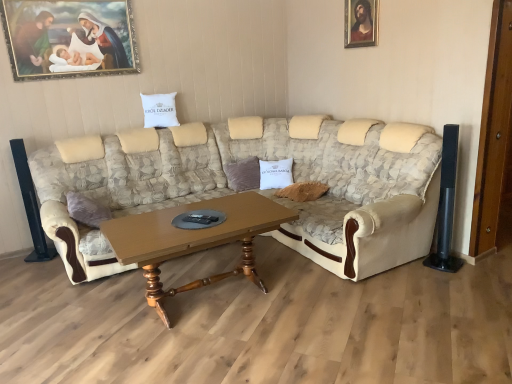
What do you see at coordinates (260, 191) in the screenshot? I see `beige fabric couch at center` at bounding box center [260, 191].

Locate an element on the screen. brown wooden coffee table at center is located at coordinates (193, 239).

From the image's perspective, is brown wooden coffee table at center below gold-framed painting at upper left, marked as the 1th picture frame in a left-to-right arrangement?

Yes, from the image's perspective, brown wooden coffee table at center is below gold-framed painting at upper left, marked as the 1th picture frame in a left-to-right arrangement.

How different are the orientations of brown wooden coffee table at center and gold-framed painting at upper left, marked as the 1th picture frame in a left-to-right arrangement, in degrees?

1.62 degrees.

Are brown wooden coffee table at center and gold-framed painting at upper left, marked as the 1th picture frame in a left-to-right arrangement, making contact?

No.

Which is in front, point (123, 256) or point (61, 34)?

The point (123, 256) is closer to the camera.

The image size is (512, 384). What are the coordinates of `studio couch lying below the wooden framed portrait at upper right, arranged as the first picture frame when viewed from the right (from the image's perspective)` in the screenshot? It's located at (260, 191).

Are wooden framed portrait at upper right, which is counted as the second picture frame, starting from the left, and beige fabric couch at center beside each other?

No, wooden framed portrait at upper right, which is counted as the second picture frame, starting from the left, is not making contact with beige fabric couch at center.

Looking at this image, is wooden framed portrait at upper right, arranged as the first picture frame when viewed from the right, completely or partially outside of beige fabric couch at center?

wooden framed portrait at upper right, arranged as the first picture frame when viewed from the right, is positioned outside beige fabric couch at center.

Locate an element on the screen. The height and width of the screenshot is (384, 512). pillow below the white cotton pillow at center, marked as the second pillow in a right-to-left arrangement (from a real-world perspective) is located at coordinates (275, 174).

Can you confirm if white cotton pillow at center, the first pillow from the top, is smaller than white cotton pillow at center, which appears as the first pillow when ordered from the bottom?

Indeed, white cotton pillow at center, the first pillow from the top, has a smaller size compared to white cotton pillow at center, which appears as the first pillow when ordered from the bottom.

Considering the relative positions of white cotton pillow at center, which ranks as the 1th pillow in left-to-right order, and white cotton pillow at center, which is counted as the 1th pillow, starting from the right, in the image provided, is white cotton pillow at center, which ranks as the 1th pillow in left-to-right order, to the left or to the right of white cotton pillow at center, which is counted as the 1th pillow, starting from the right,?

white cotton pillow at center, which ranks as the 1th pillow in left-to-right order, is positioned on white cotton pillow at center, which is counted as the 1th pillow, starting from the right,'s left side.

Find the location of `coffee table that is in front of the white cotton pillow at center, which appears as the first pillow when ordered from the bottom`. coffee table that is in front of the white cotton pillow at center, which appears as the first pillow when ordered from the bottom is located at coordinates click(x=193, y=239).

From the image's perspective, is brown wooden coffee table at center positioned above or below white cotton pillow at center, positioned as the 2th pillow in top-to-bottom order?

From the image's perspective, brown wooden coffee table at center appears below white cotton pillow at center, positioned as the 2th pillow in top-to-bottom order.

Which is closer, (113, 246) or (269, 176)?

Point (113, 246) is positioned closer to the camera compared to point (269, 176).

Is beige fabric couch at center next to gold-framed painting at upper left, marked as the 1th picture frame in a left-to-right arrangement, and touching it?

No, beige fabric couch at center is not in contact with gold-framed painting at upper left, marked as the 1th picture frame in a left-to-right arrangement.

From a real-world perspective, is beige fabric couch at center positioned under gold-framed painting at upper left, marked as the 1th picture frame in a left-to-right arrangement, based on gravity?

Yes, from a real-world perspective, beige fabric couch at center is below gold-framed painting at upper left, marked as the 1th picture frame in a left-to-right arrangement.

From the image's perspective, relative to gold-framed painting at upper left, acting as the second picture frame starting from the right, is beige fabric couch at center above or below?

Based on their image positions, beige fabric couch at center is located beneath gold-framed painting at upper left, acting as the second picture frame starting from the right.

How different are the orientations of beige fabric couch at center and gold-framed painting at upper left, acting as the second picture frame starting from the right, in degrees?

0.0462 degrees.

Between wooden framed portrait at upper right, arranged as the first picture frame when viewed from the right, and white cotton pillow at center, which is the 2th pillow from left to right, which one has smaller width?

wooden framed portrait at upper right, arranged as the first picture frame when viewed from the right, is thinner.

From the white cotton pillow at center, which appears as the first pillow when ordered from the bottom, count 1st picture frames forward and point to it. Please provide its 2D coordinates.

[(360, 23)]

Looking at this image, which object is positioned more to the right, wooden framed portrait at upper right, which is counted as the second picture frame, starting from the left, or white cotton pillow at center, positioned as the 2th pillow in top-to-bottom order?

Positioned to the right is wooden framed portrait at upper right, which is counted as the second picture frame, starting from the left.

Which of these two, wooden framed portrait at upper right, which is counted as the second picture frame, starting from the left, or white cotton pillow at center, which is counted as the 1th pillow, starting from the right, is smaller?

Smaller between the two is wooden framed portrait at upper right, which is counted as the second picture frame, starting from the left.

How different are the orientations of white cotton pillow at center, which is the 2th pillow from left to right, and gold-framed painting at upper left, acting as the second picture frame starting from the right, in degrees?

They differ by 36.5 degrees in their facing directions.

Considering the sizes of objects white cotton pillow at center, which is counted as the 1th pillow, starting from the right, and gold-framed painting at upper left, marked as the 1th picture frame in a left-to-right arrangement, in the image provided, who is thinner, white cotton pillow at center, which is counted as the 1th pillow, starting from the right, or gold-framed painting at upper left, marked as the 1th picture frame in a left-to-right arrangement,?

gold-framed painting at upper left, marked as the 1th picture frame in a left-to-right arrangement.

Is white cotton pillow at center, which is the 2th pillow from left to right, to the left or to the right of gold-framed painting at upper left, marked as the 1th picture frame in a left-to-right arrangement, in the image?

white cotton pillow at center, which is the 2th pillow from left to right, is to the right of gold-framed painting at upper left, marked as the 1th picture frame in a left-to-right arrangement.

Identify the location of picture frame that is the 1st object above the white cotton pillow at center, positioned as the 2th pillow in top-to-bottom order (from a real-world perspective). Image resolution: width=512 pixels, height=384 pixels. (69, 38).

Identify the location of coffee table lying in front of the gold-framed painting at upper left, acting as the second picture frame starting from the right. (193, 239).

In the image, there is a wooden framed portrait at upper right, arranged as the first picture frame when viewed from the right. Identify the location of studio couch below it (from the image's perspective). The width and height of the screenshot is (512, 384). (260, 191).

Looking at the image, which one is located further to white cotton pillow at center, marked as the second pillow in a right-to-left arrangement, wooden framed portrait at upper right, arranged as the first picture frame when viewed from the right, or gold-framed painting at upper left, acting as the second picture frame starting from the right?

wooden framed portrait at upper right, arranged as the first picture frame when viewed from the right.

From the image, which object appears to be nearer to white cotton pillow at center, which is counted as the 1th pillow, starting from the right, beige fabric couch at center or white cotton pillow at center, the first pillow from the top?

beige fabric couch at center is closer to white cotton pillow at center, which is counted as the 1th pillow, starting from the right.

Based on their spatial positions, is beige fabric couch at center or gold-framed painting at upper left, acting as the second picture frame starting from the right, closer to white cotton pillow at center, which appears as the first pillow when ordered from the bottom?

beige fabric couch at center is positioned closer to the anchor white cotton pillow at center, which appears as the first pillow when ordered from the bottom.

Estimate the real-world distances between objects in this image. Which object is further from wooden framed portrait at upper right, which is counted as the second picture frame, starting from the left, gold-framed painting at upper left, acting as the second picture frame starting from the right, or white cotton pillow at center, which appears as the first pillow when ordered from the bottom?

gold-framed painting at upper left, acting as the second picture frame starting from the right.

Based on their spatial positions, is white cotton pillow at center, which is the 2th pillow from left to right, or brown wooden coffee table at center closer to white cotton pillow at center, which is counted as the second pillow, starting from the bottom?

Based on the image, white cotton pillow at center, which is the 2th pillow from left to right, appears to be nearer to white cotton pillow at center, which is counted as the second pillow, starting from the bottom.

Looking at the image, which one is located closer to white cotton pillow at center, the first pillow from the top, gold-framed painting at upper left, acting as the second picture frame starting from the right, or beige fabric couch at center?

gold-framed painting at upper left, acting as the second picture frame starting from the right, lies closer to white cotton pillow at center, the first pillow from the top, than the other object.

Looking at the image, which one is located closer to brown wooden coffee table at center, white cotton pillow at center, the first pillow from the top, or beige fabric couch at center?

Based on the image, beige fabric couch at center appears to be nearer to brown wooden coffee table at center.

Consider the image. Looking at the image, which one is located further to wooden framed portrait at upper right, arranged as the first picture frame when viewed from the right, beige fabric couch at center or brown wooden coffee table at center?

Based on the image, brown wooden coffee table at center appears to be further to wooden framed portrait at upper right, arranged as the first picture frame when viewed from the right.

Where is `coffee table positioned between beige fabric couch at center and white cotton pillow at center, which is counted as the 1th pillow, starting from the right, from near to far`? This screenshot has height=384, width=512. coffee table positioned between beige fabric couch at center and white cotton pillow at center, which is counted as the 1th pillow, starting from the right, from near to far is located at coordinates (193, 239).

Where is `pillow between white cotton pillow at center, marked as the second pillow in a right-to-left arrangement, and wooden framed portrait at upper right, which is counted as the second picture frame, starting from the left, from left to right`? pillow between white cotton pillow at center, marked as the second pillow in a right-to-left arrangement, and wooden framed portrait at upper right, which is counted as the second picture frame, starting from the left, from left to right is located at coordinates (275, 174).

In order to click on pillow located between beige fabric couch at center and white cotton pillow at center, marked as the second pillow in a right-to-left arrangement, in the depth direction in this screenshot , I will do `click(275, 174)`.

You are a GUI agent. You are given a task and a screenshot of the screen. Output one action in this format:
    pyautogui.click(x=<x>, y=<y>)
    Task: Click on the pillow located between brown wooden coffee table at center and white cotton pillow at center, marked as the second pillow in a right-to-left arrangement, in the depth direction
    The image size is (512, 384).
    Given the screenshot: What is the action you would take?
    pyautogui.click(x=275, y=174)